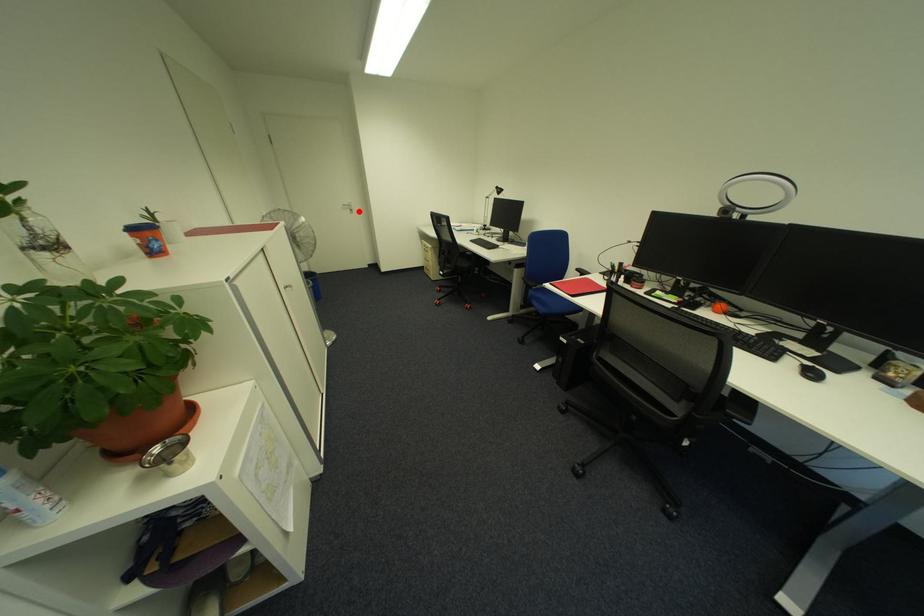
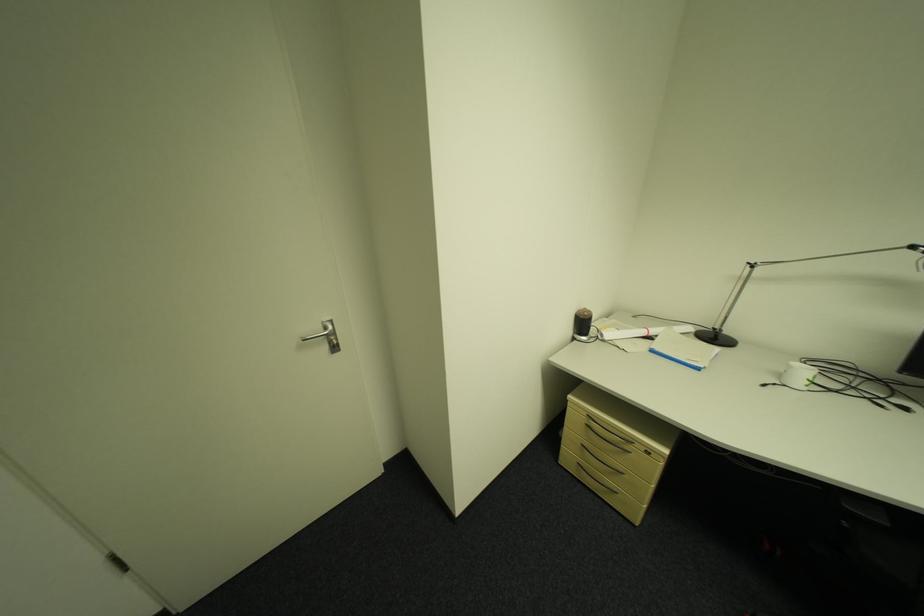
In the second image, find the point that corresponds to the highlighted location in the first image.

(335, 349)